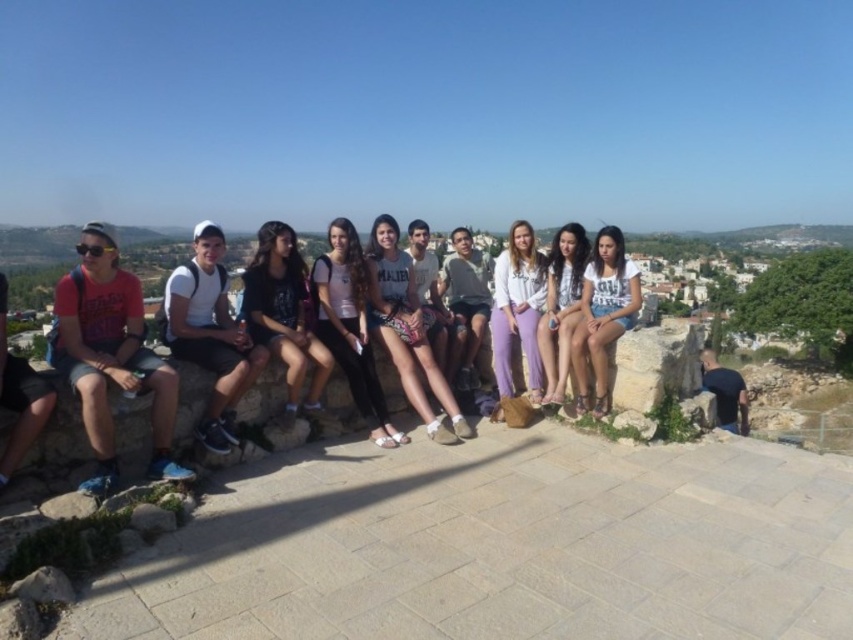
Is point (294, 301) positioned after point (505, 269)?

No, (294, 301) is closer to viewer.

Is point (288, 236) closer to camera compared to point (498, 305)?

That is True.

This screenshot has height=640, width=853. What are the coordinates of `matte black jacket at center` in the screenshot? It's located at (283, 312).

Does white printed tank top at center appear on the right side of matte black jacket at center?

Indeed, white printed tank top at center is positioned on the right side of matte black jacket at center.

Is white printed tank top at center in front of matte black jacket at center?

No, it is behind matte black jacket at center.

Does point (379, 252) come closer to viewer compared to point (271, 225)?

That is False.

In order to click on white printed tank top at center in this screenshot , I will do `click(405, 330)`.

Who is more distant from viewer, (631, 324) or (560, 275)?

The point (560, 275) is more distant.

Does point (592, 298) come farther from viewer compared to point (552, 385)?

Yes, point (592, 298) is farther from viewer.

Where is `white cotton shirt at center`? Image resolution: width=853 pixels, height=640 pixels. white cotton shirt at center is located at coordinates (602, 316).